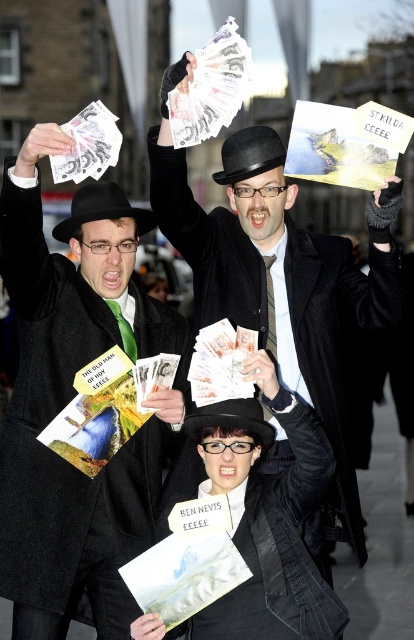
Who is positioned more to the left, black felt hat at upper center or black felt hat at center?

From the viewer's perspective, black felt hat at upper center appears more on the left side.

Does black felt hat at upper center have a lesser height compared to black felt hat at center?

No.

Does point (81, 196) lie in front of point (262, 417)?

No, (81, 196) is further to viewer.

Where is `black felt hat at upper center`? The width and height of the screenshot is (414, 640). black felt hat at upper center is located at coordinates (101, 209).

Measure the distance between matte black coat at center and black felt bowler hat at center.

The distance of matte black coat at center from black felt bowler hat at center is 6.58 meters.

How distant is matte black coat at center from black felt bowler hat at center?

They are 21.59 feet apart.

Does point (221, 282) lie behind point (274, 131)?

No, (221, 282) is in front of (274, 131).

The image size is (414, 640). Find the location of `matte black coat at center`. matte black coat at center is located at coordinates (284, 294).

From the picture: Is the position of matte black coat at center more distant than that of white paper money at center?

No, matte black coat at center is closer to the viewer.

Is the position of matte black coat at center less distant than that of white paper money at center?

Yes, it is in front of white paper money at center.

Locate an element on the screen. The width and height of the screenshot is (414, 640). matte black coat at center is located at coordinates (284, 294).

Find the location of a particular element. matte black coat at center is located at coordinates (284, 294).